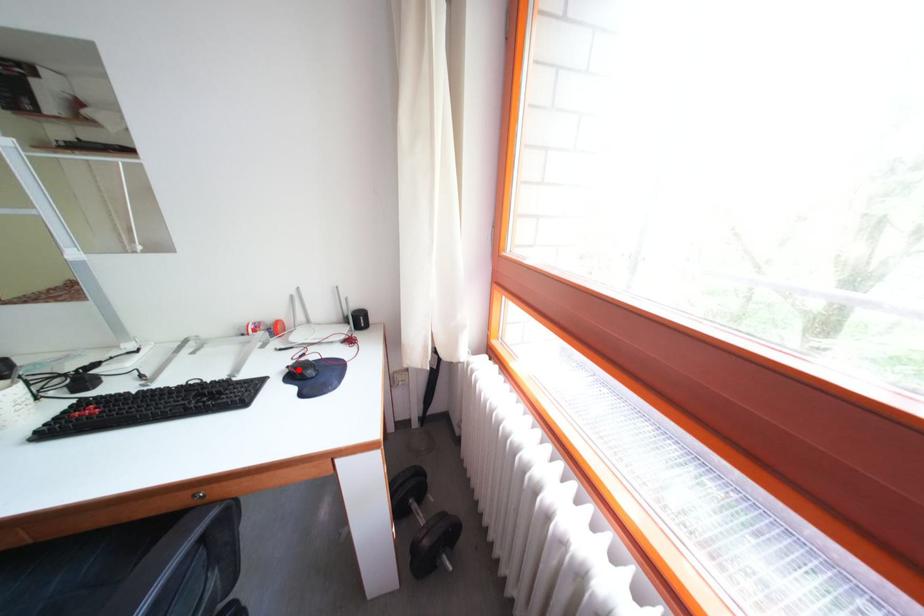
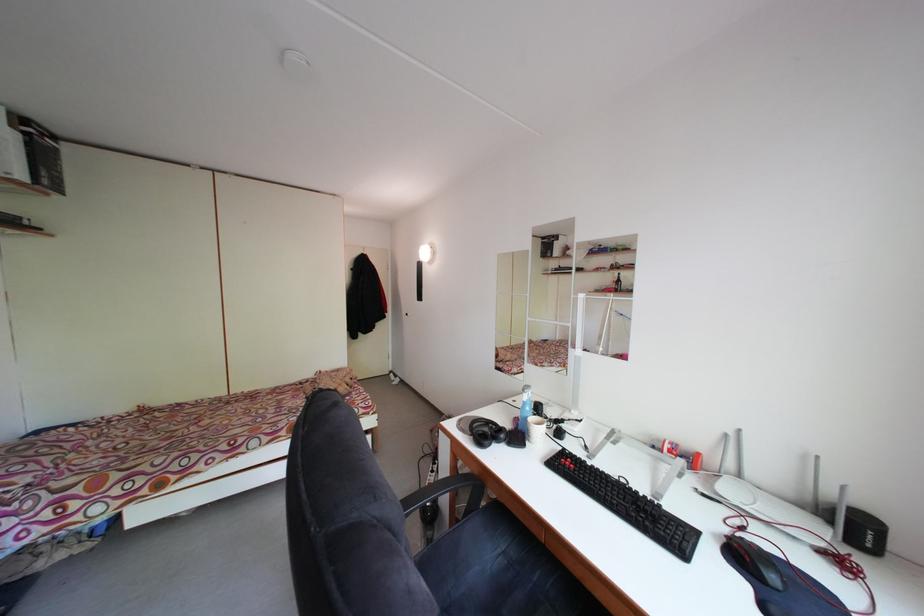
Locate, in the second image, the point that corresponds to the highlighted location in the first image.

(735, 536)